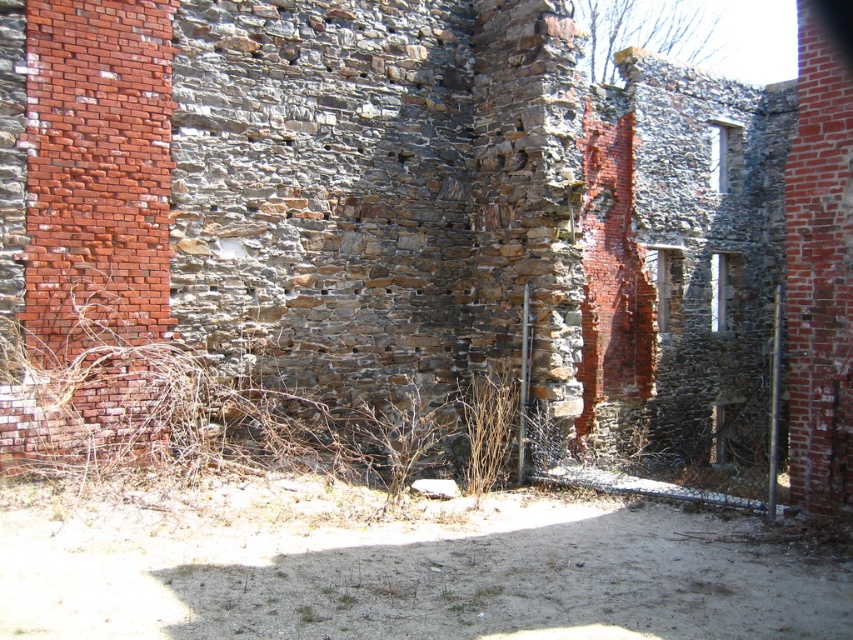
Question: Where is brown dry weed at center located in relation to brown dry grass at center in the image?

Choices:
 (A) below
 (B) above

Answer: (B)

Question: Considering the relative positions of brown dry weed at center and brown dry grass at center in the image provided, where is brown dry weed at center located with respect to brown dry grass at center?

Choices:
 (A) above
 (B) below

Answer: (A)

Question: Which of the following is the farthest from the observer?

Choices:
 (A) brown dry grass at center
 (B) brown dry weed at center

Answer: (A)

Question: Is brown dry weed at center to the left of brown dry grass at center from the viewer's perspective?

Choices:
 (A) yes
 (B) no

Answer: (A)